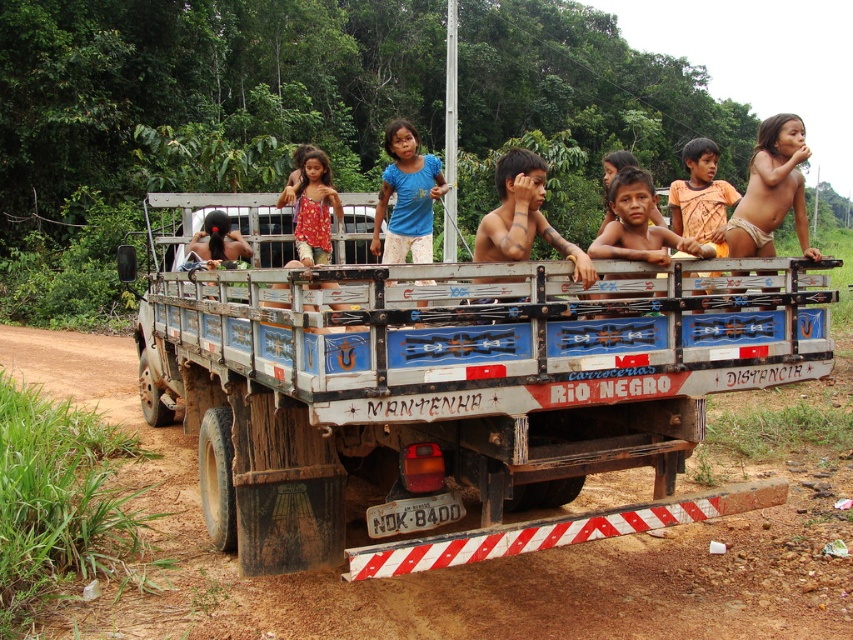
Who is positioned more to the right, wooden trailer truck at center or blue cotton shirt at center?

Positioned to the right is blue cotton shirt at center.

Does wooden trailer truck at center have a smaller size compared to blue cotton shirt at center?

Actually, wooden trailer truck at center might be larger than blue cotton shirt at center.

This screenshot has height=640, width=853. What do you see at coordinates (450, 394) in the screenshot?
I see `wooden trailer truck at center` at bounding box center [450, 394].

The width and height of the screenshot is (853, 640). Find the location of `wooden trailer truck at center`. wooden trailer truck at center is located at coordinates (450, 394).

Can you confirm if wooden trailer truck at center is thinner than red floral dress at center?

In fact, wooden trailer truck at center might be wider than red floral dress at center.

Can you confirm if wooden trailer truck at center is bigger than red floral dress at center?

Yes, wooden trailer truck at center is bigger than red floral dress at center.

What do you see at coordinates (450, 394) in the screenshot?
I see `wooden trailer truck at center` at bounding box center [450, 394].

Where is `wooden trailer truck at center`? wooden trailer truck at center is located at coordinates (450, 394).

Between brown wooden truck at center and blue cotton shirt at center, which one appears on the left side from the viewer's perspective?

Positioned to the left is blue cotton shirt at center.

Does brown wooden truck at center appear on the right side of blue cotton shirt at center?

Indeed, brown wooden truck at center is positioned on the right side of blue cotton shirt at center.

From the picture: Who is more distant from viewer, (583, 282) or (421, 218)?

The point (421, 218) is more distant.

Where is `brown wooden truck at center`? brown wooden truck at center is located at coordinates (523, 218).